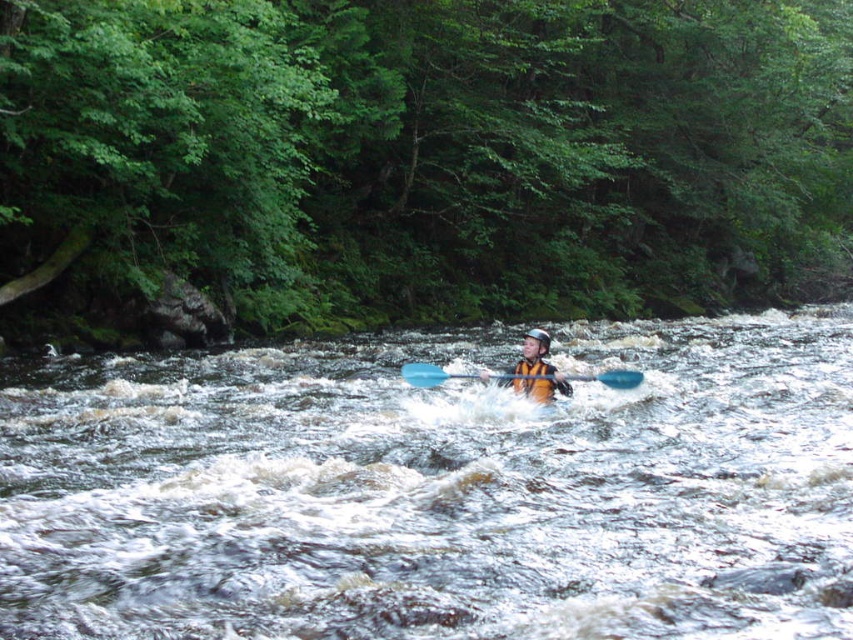
Based on the photo, you are a photographer planning to take a photo of the kayaker. You notice the white frothy water at center and the yellow life jacket at center in the scene. Which object appears larger in the photo?

The white frothy water at center appears larger in the photo because it is much taller than the yellow life jacket at center.

You are a drone operator trying to capture the kayaker navigating the river. You have two points marked on your screen for camera positioning. Point A is at coordinates point (1,545) and Point B is at coordinates point (619,380). To ensure the kayaker remains centered in the frame while moving downstream, which point should you prioritize placing the camera closer to?

Point A at coordinates point (1,545) should be prioritized because it is in front of point B at coordinates point (619,380). Positioning the camera closer to the point in front will keep the kayaker centered as they move downstream.

You are a photographer trying to capture the kayaker in the center of the image. You notice the yellow life jacket at center and the blue plastic paddle at center. Which object is closer to your camera lens?

The yellow life jacket at center is closer to the camera lens than the blue plastic paddle at center because it is further to the viewer.